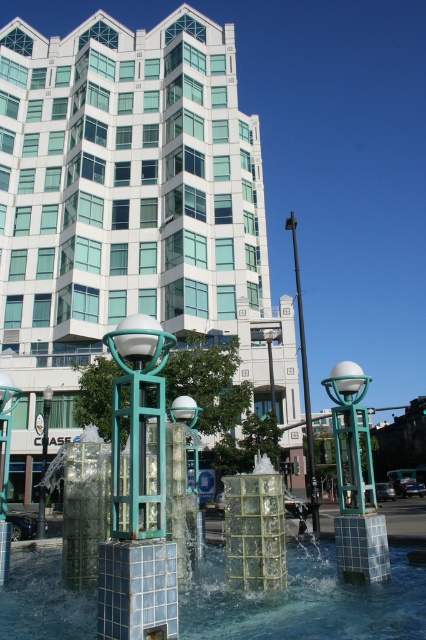
Question: Which of the following is the farthest from the observer?

Choices:
 (A) metallic pole at center
 (B) white glass building at center
 (C) translucent glass water at center

Answer: (B)

Question: Is translucent glass water at center wider than metallic pole at center?

Choices:
 (A) yes
 (B) no

Answer: (B)

Question: Is white glass building at center bigger than translucent glass water at center?

Choices:
 (A) yes
 (B) no

Answer: (A)

Question: In this image, where is translucent glass water at center located relative to metallic pole at center?

Choices:
 (A) below
 (B) above

Answer: (A)

Question: Considering the real-world distances, which object is closest to the metallic pole at center?

Choices:
 (A) white glass building at center
 (B) translucent glass water at center

Answer: (B)

Question: Which point is farther to the camera?

Choices:
 (A) metallic pole at center
 (B) translucent glass water at center

Answer: (A)